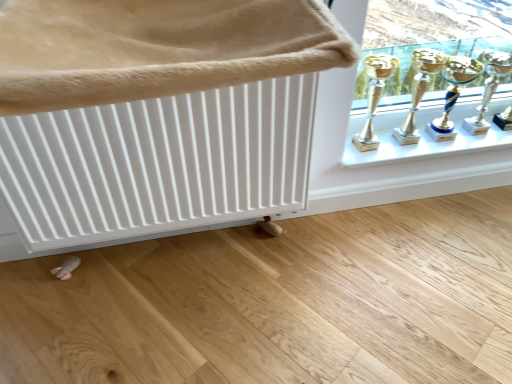
What are the coordinates of `vacant space underneath white textured radiator at upper left (from a real-world perspective)` in the screenshot? It's located at (198, 316).